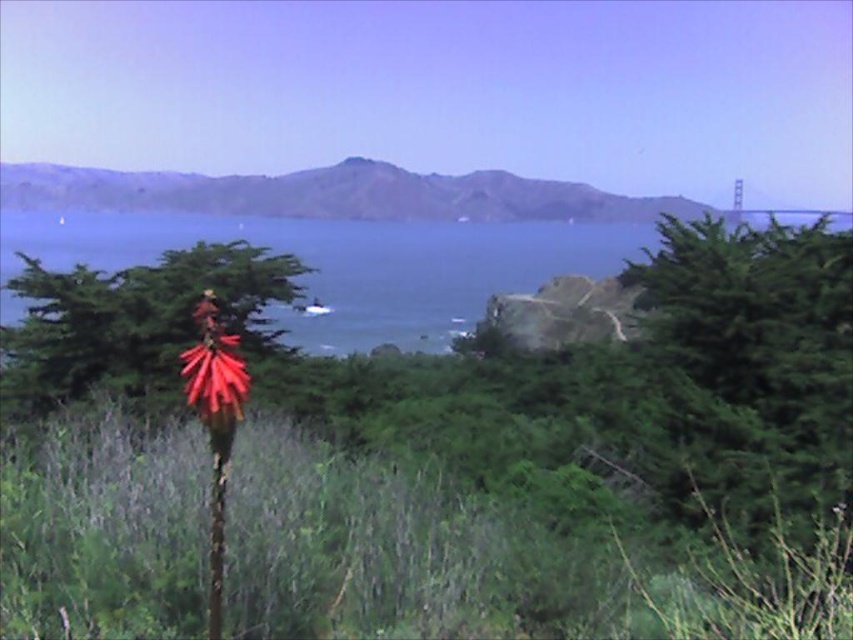
You are a photographer positioned at the camera location. You want to capture both the point at coordinates point (141, 269) and point (126, 193) in your shot. Which point will appear larger in your photo?

Point (141, 269) is closer to the camera than point (126, 193), so it will appear larger in the photo.

You are a hiker standing at the trailhead looking at the green textured tree at right and the green grassy hillside at upper center. Which object is taller?

The green textured tree at right is shorter than the green grassy hillside at upper center, so the green grassy hillside at upper center is taller.